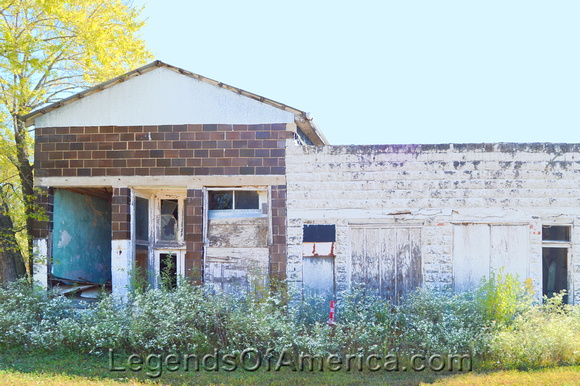
Find the location of a particular element. This screenshot has width=580, height=386. window is located at coordinates (190, 210).